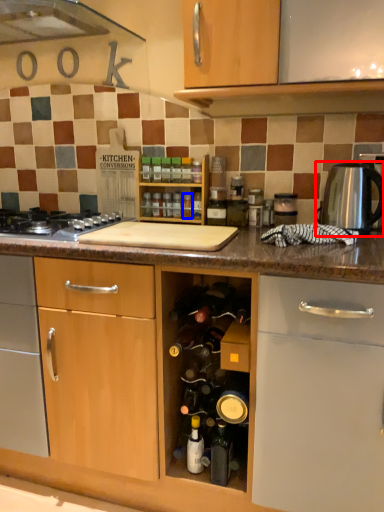
Question: Which point is closer to the camera, kitchen appliance (highlighted by a red box) or bottle (highlighted by a blue box)?

Choices:
 (A) kitchen appliance
 (B) bottle

Answer: (A)